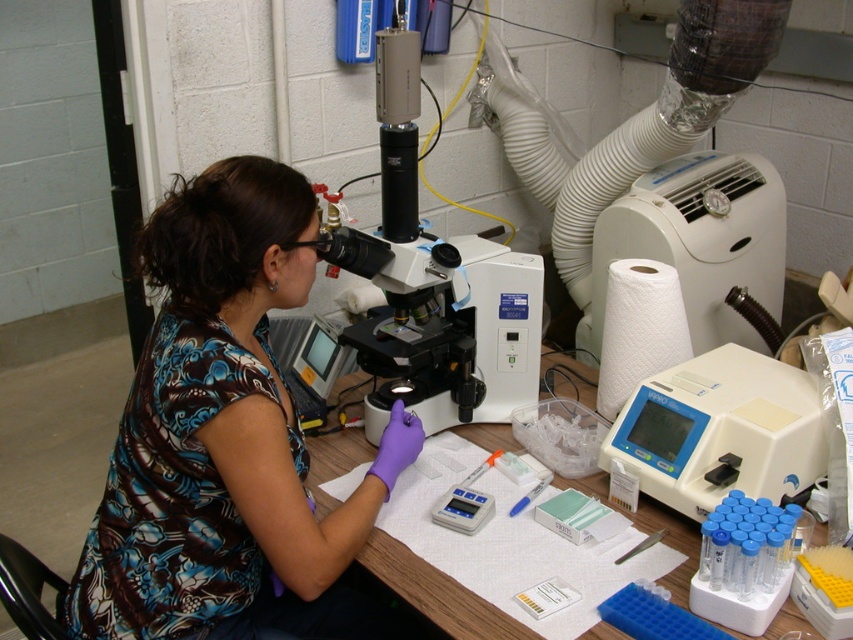
Question: Which of these objects is positioned farthest from the white plastic machine at right?

Choices:
 (A) wooden table at center
 (B) white plastic microscope at center
 (C) blue plastic pen at center
 (D) floral fabric shirt at center

Answer: (D)

Question: Is floral fabric shirt at center closer to camera compared to wooden table at center?

Choices:
 (A) yes
 (B) no

Answer: (B)

Question: Can you confirm if wooden table at center is positioned above white plastic machine at right?

Choices:
 (A) no
 (B) yes

Answer: (A)

Question: Which point is closer to the camera?

Choices:
 (A) floral fabric shirt at center
 (B) white plastic microscope at center
 (C) wooden table at center

Answer: (C)

Question: Which object is farther from the camera taking this photo?

Choices:
 (A) white plastic microscope at center
 (B) white plastic machine at right
 (C) floral fabric shirt at center

Answer: (A)

Question: Can you confirm if white plastic microscope at center is thinner than blue plastic pen at center?

Choices:
 (A) no
 (B) yes

Answer: (A)